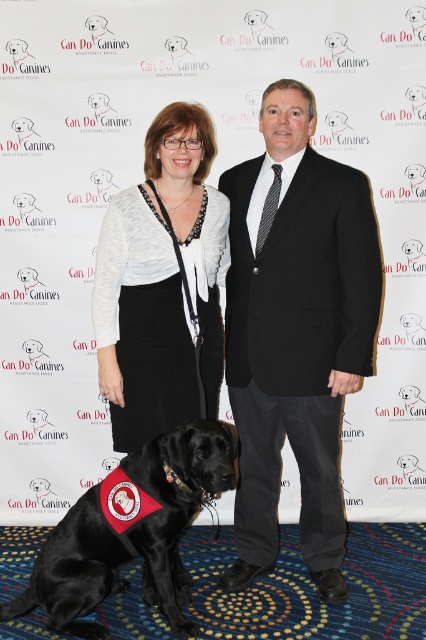
You are attending a Can Do Canines Assistance Dogs event and notice two people standing in front of the logo backdrop. You see a black wool suit at center and a matte white blouse at center. Which clothing item is located to the right of the other?

The black wool suit at center is positioned on the right side of matte white blouse at center.

You are a photographer taking a portrait of the woman wearing the white blouse at center. You want to ensure the focus is on her face, which is at point (141, 323). However, there is a distracting logo from the backdrop overlapping this point. Can you adjust your camera to avoid the logo while keeping the focus on her face?

The point (141, 323) is on the matte white blouse at center, so adjusting the camera focus to this point will keep the focus on her face without overlapping the backdrop logo.